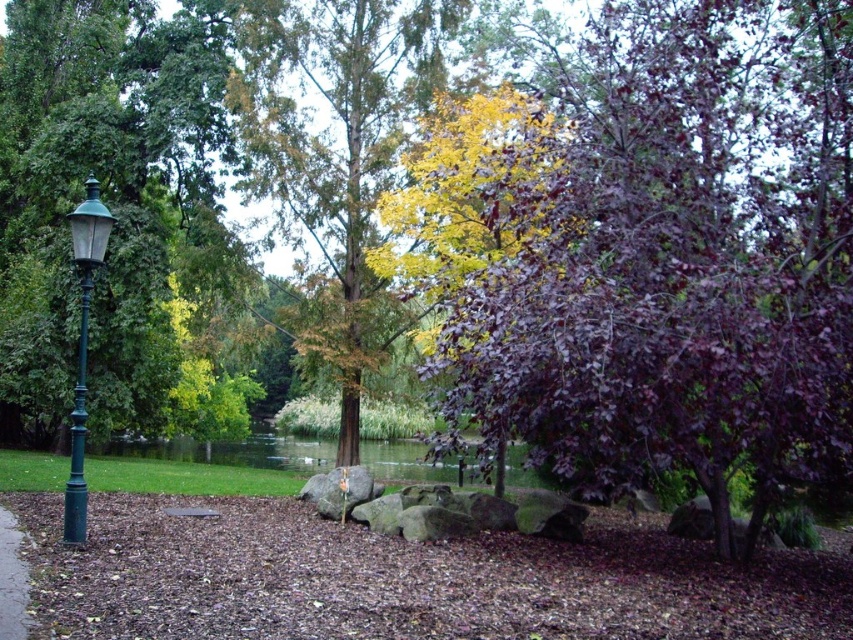
Does purple glossy tree at center appear on the right side of green polished metal pole at left?

Indeed, purple glossy tree at center is positioned on the right side of green polished metal pole at left.

Which of these two, purple glossy tree at center or green polished metal pole at left, stands taller?

With more height is purple glossy tree at center.

Between point (619, 177) and point (73, 452), which one is positioned behind?

Positioned behind is point (619, 177).

Locate an element on the screen. The width and height of the screenshot is (853, 640). purple glossy tree at center is located at coordinates (677, 259).

Is point (279, 442) positioned before point (3, 557)?

No, it is not.

Between green grassy lake at center and brown gravel path at lower left, which one appears on the right side from the viewer's perspective?

From the viewer's perspective, brown gravel path at lower left appears more on the right side.

What do you see at coordinates (236, 451) in the screenshot?
I see `green grassy lake at center` at bounding box center [236, 451].

What are the coordinates of `green grassy lake at center` in the screenshot? It's located at (236, 451).

Is green polished metal pole at left above brown gravel path at lower left?

Yes.

Who is positioned more to the right, green polished metal pole at left or brown gravel path at lower left?

brown gravel path at lower left

Who is more forward, (85, 419) or (15, 636)?

Point (15, 636) is in front.

Locate an element on the screen. The width and height of the screenshot is (853, 640). green polished metal pole at left is located at coordinates click(x=78, y=428).